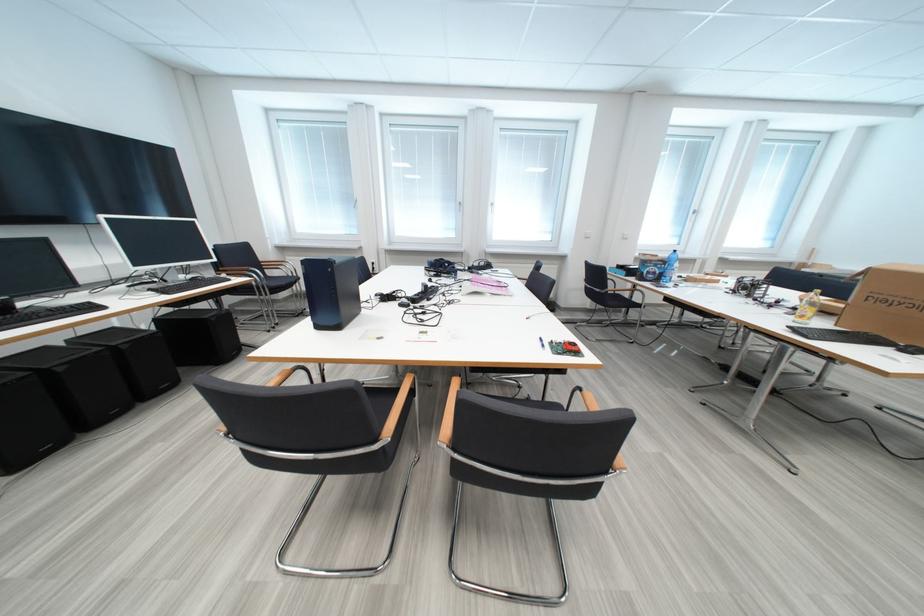
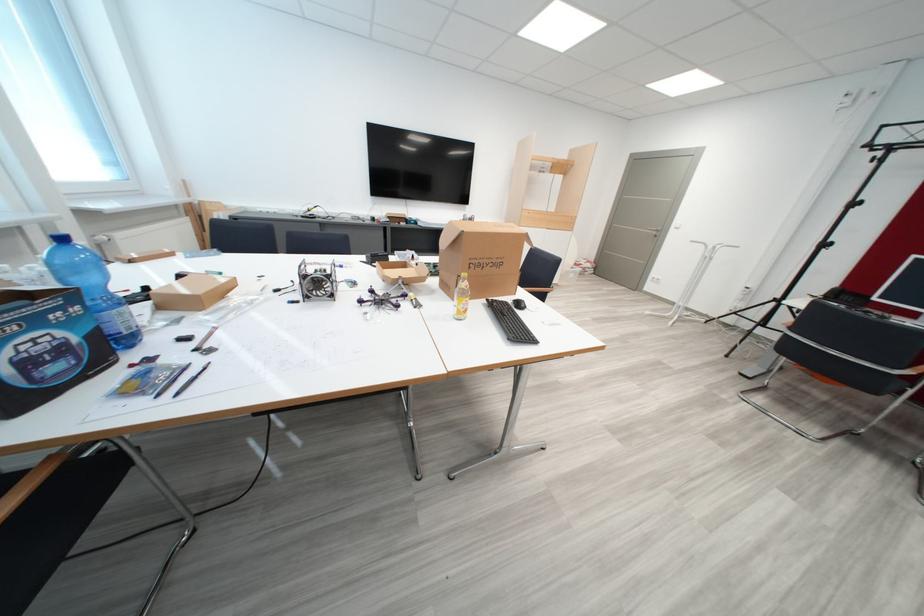
The point at (665, 268) is marked in the first image. Where is the corresponding point in the second image?

(46, 323)